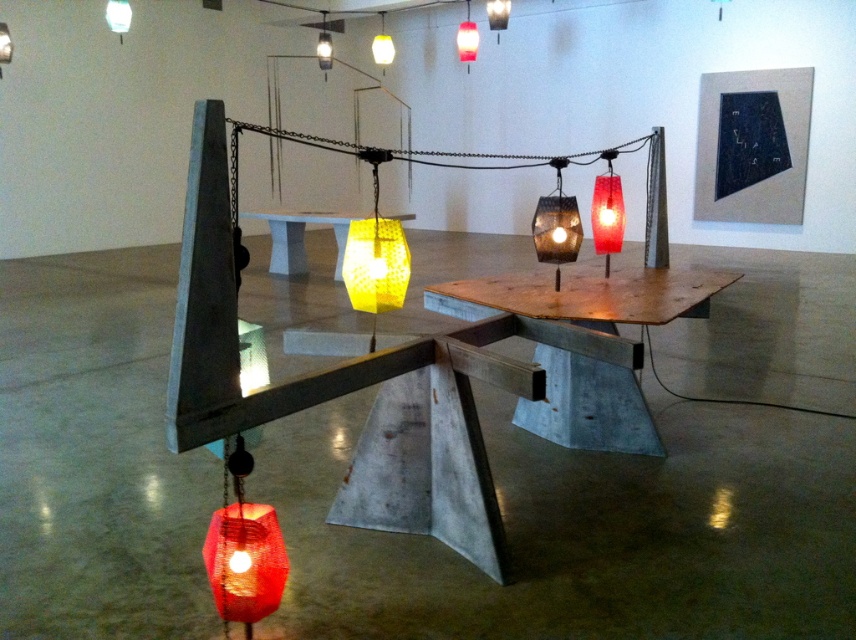
Question: Considering the real-world distances, which object is farthest from the matte red glass lantern at upper center?

Choices:
 (A) matte glass lamp at center
 (B) wooden table at center
 (C) matte white lampshade at upper left

Answer: (B)

Question: Which object is positioned closest to the yellow matte lantern at center?

Choices:
 (A) matte red lantern at lower left
 (B) matte yellow glass lamp at upper center
 (C) matte yellow glass lamp at center

Answer: (A)

Question: Is yellow matte lantern at center to the left of matte black lampshade at upper center from the viewer's perspective?

Choices:
 (A) no
 (B) yes

Answer: (B)

Question: Does translucent yellow glass table at center have a larger size compared to matte white lampshade at upper left?

Choices:
 (A) no
 (B) yes

Answer: (B)

Question: Which object is the farthest from the metallic chain at center?

Choices:
 (A) matte yellow glass lamp at upper center
 (B) matte red lantern at lower left

Answer: (A)

Question: Where is wooden table at center located in relation to matte red glass lantern at upper center in the image?

Choices:
 (A) left
 (B) right

Answer: (B)